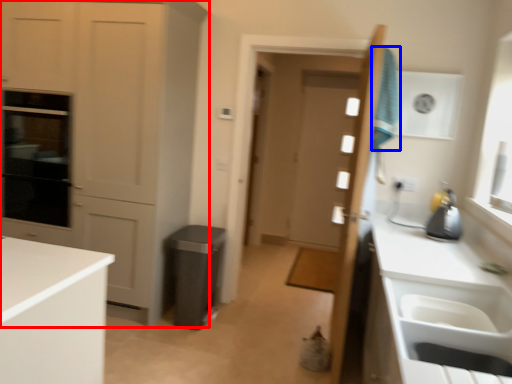
Question: Which object appears closest to the camera in this image, cabinetry (highlighted by a red box) or laundry (highlighted by a blue box)?

Choices:
 (A) cabinetry
 (B) laundry

Answer: (B)